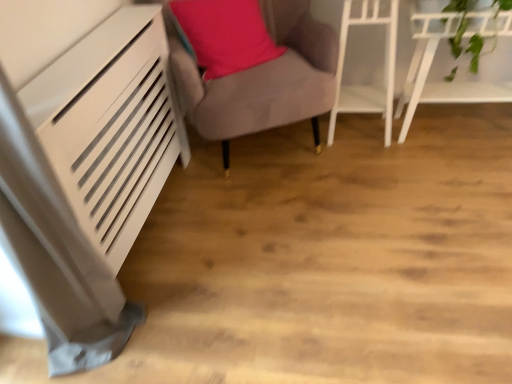
Image resolution: width=512 pixels, height=384 pixels. I want to click on free region under white glossy shelf at upper right, placed as the third furniture when sorted from left to right (from a real-world perspective), so click(448, 129).